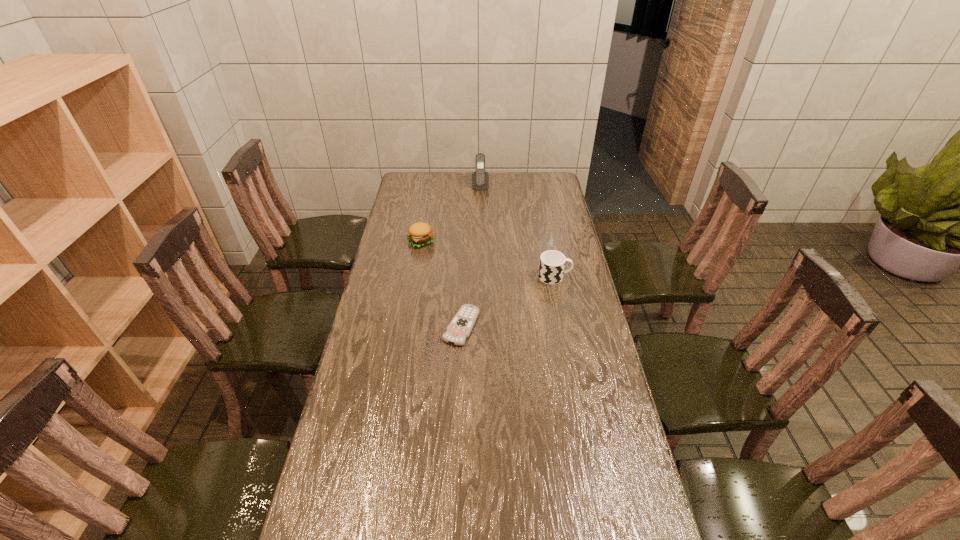
Locate an element on the screen. The image size is (960, 540). free space that is in between the cup and the shortest object is located at coordinates (508, 302).

Select which object appears as the second closest to the cellular telephone. Please provide its 2D coordinates. Your answer should be formatted as a tuple, i.e. [(x, y)], where the tuple contains the x and y coordinates of a point satisfying the conditions above.

[(552, 263)]

Select which object is the third closest to the remote control. Please provide its 2D coordinates. Your answer should be formatted as a tuple, i.e. [(x, y)], where the tuple contains the x and y coordinates of a point satisfying the conditions above.

[(480, 179)]

Locate an element on the screen. free spot that satisfies the following two spatial constraints: 1. on the front side of the second farthest object; 2. on the right side of the remote control is located at coordinates (406, 326).